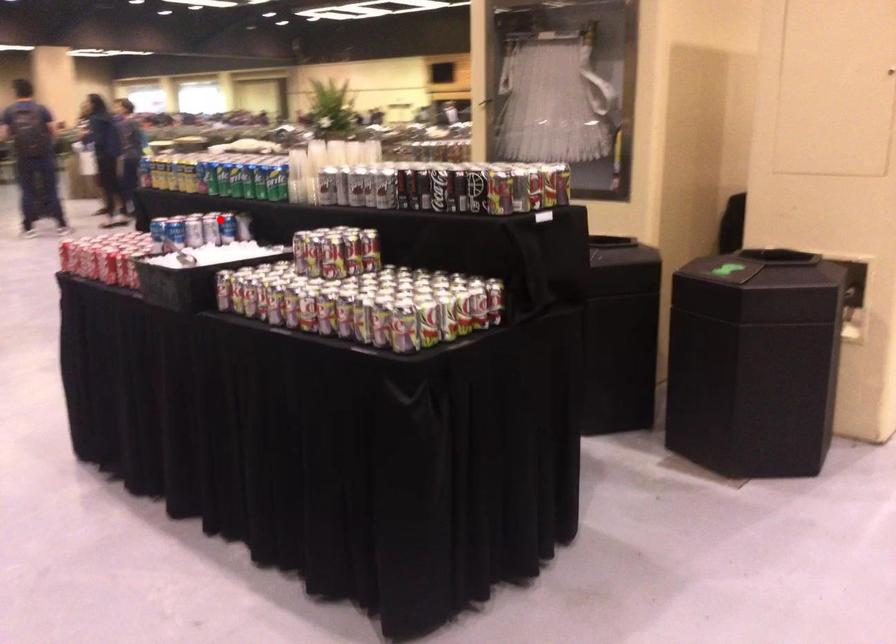
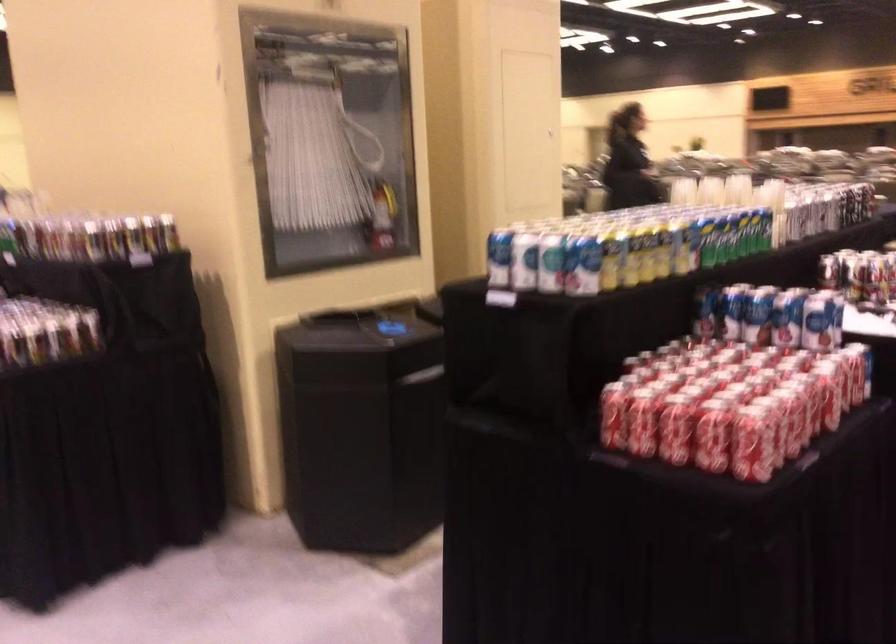
Question: I am providing you with two images of the same scene from different viewpoints. Given a red point in image1, look at the same physical point in image2. Is it:

Choices:
 (A) Closer to the viewpoint
 (B) Farther from the viewpoint

Answer: (A)